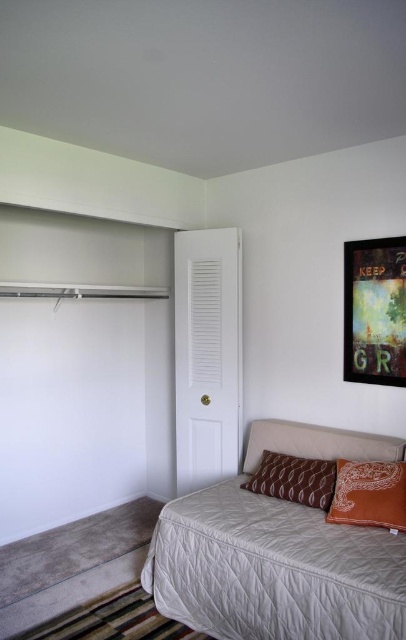
You are trying to decide where to place a new bookshelf in your bedroom. The bookshelf is 1.2 meters tall. You see the beige quilted bed at lower right and the brown patterned pillow at center. Which object is taller, and can the bookshelf fit vertically next to the taller one?

The beige quilted bed at lower right is taller than the brown patterned pillow at center. Since the bookshelf is 1.2 meters tall, it can be placed vertically next to the beige quilted bed at lower right as long as there is sufficient space between them.

You are standing in the bedroom and want to place a small plant between the two points labeled point (282,445) and point (315,461). Which point should the plant be closer to in order to be closer to the camera?

The plant should be closer to point (282,445) because it is further to the camera than point (315,461).

You are standing in the bedroom corner and want to place a new picture frame between the metallic framed artwork at upper right and the brown textured pillow at lower right. Based on their positions, which object should you place the new frame closer to?

You should place the new frame closer to the brown textured pillow at lower right because the metallic framed artwork at upper right is to the right of the brown textured pillow at lower right, so the pillow is to the left of the artwork. Therefore, placing the new frame closer to the pillow would maintain the leftward direction from the artwork.